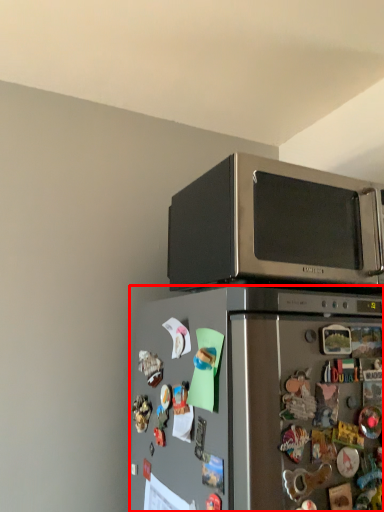
Question: In this image, where is refrigerator (annotated by the red box) located relative to microwave oven?

Choices:
 (A) left
 (B) right

Answer: (A)